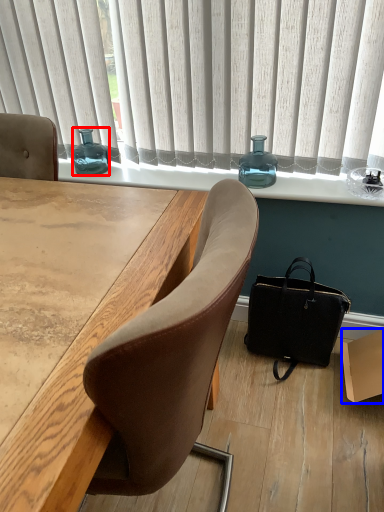
Question: Which of the following is the farthest to the observer, bottle (highlighted by a red box) or box (highlighted by a blue box)?

Choices:
 (A) bottle
 (B) box

Answer: (A)